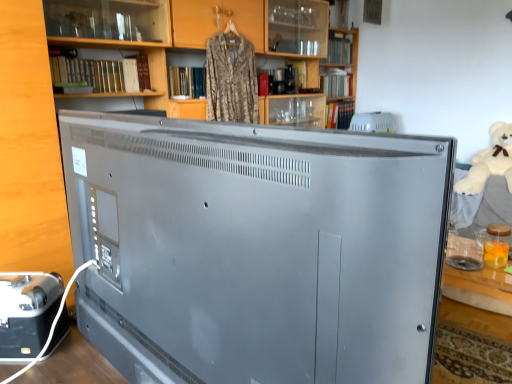
Measure the distance between point (x=318, y=60) and camera.

Point (x=318, y=60) is 3.78 meters from camera.

What do you see at coordinates (27, 312) in the screenshot? This screenshot has width=512, height=384. I see `metallic silver toaster at lower left, the 1th appliance in the bottom-to-top sequence` at bounding box center [27, 312].

Describe the element at coordinates (256, 249) in the screenshot. I see `satin gray television at center` at that location.

In order to face white plastic speaker at upper center, placed as the 2th appliance when sorted from front to back, should I rotate leftwards or rightwards?

A 15.844 degree turn to the right will do.

What do you see at coordinates (373, 122) in the screenshot?
I see `white plastic speaker at upper center, the 1th appliance viewed from the top` at bounding box center [373, 122].

Identify the location of matte wood bookcase at upper center. (218, 32).

Does camouflage fabric shirt at upper center have a lesser height compared to metallic silver toaster at lower left, placed as the second appliance when sorted from right to left?

No, camouflage fabric shirt at upper center is not shorter than metallic silver toaster at lower left, placed as the second appliance when sorted from right to left.

How far apart are camouflage fabric shirt at upper center and metallic silver toaster at lower left, the 1th appliance in the bottom-to-top sequence?

The distance of camouflage fabric shirt at upper center from metallic silver toaster at lower left, the 1th appliance in the bottom-to-top sequence, is 1.78 meters.

Consider the image. Between camouflage fabric shirt at upper center and metallic silver toaster at lower left, the 1th appliance in the bottom-to-top sequence, which one appears on the right side from the viewer's perspective?

camouflage fabric shirt at upper center.

Locate an element on the screen. The height and width of the screenshot is (384, 512). appliance in front of the camouflage fabric shirt at upper center is located at coordinates (27, 312).

Where is `television on the right of metallic silver toaster at lower left, placed as the second appliance when sorted from right to left`? television on the right of metallic silver toaster at lower left, placed as the second appliance when sorted from right to left is located at coordinates pyautogui.click(x=256, y=249).

Is satin gray television at center positioned with its back to metallic silver toaster at lower left, which is the 2th appliance in back-to-front order?

No, satin gray television at center is not facing away from metallic silver toaster at lower left, which is the 2th appliance in back-to-front order.

Looking at the image, does satin gray television at center seem bigger or smaller compared to metallic silver toaster at lower left, placed as the second appliance when sorted from right to left?

satin gray television at center is bigger than metallic silver toaster at lower left, placed as the second appliance when sorted from right to left.

Is white plastic speaker at upper center, the 1th appliance in the right-to-left sequence, oriented towards matte wood bookcase at upper center?

No, white plastic speaker at upper center, the 1th appliance in the right-to-left sequence, is not oriented towards matte wood bookcase at upper center.

Is point (362, 126) less distant than point (251, 10)?

No, (362, 126) is behind (251, 10).

From a real-world perspective, is white plastic speaker at upper center, the 1th appliance viewed from the top, on top of matte wood bookcase at upper center?

Incorrect, from a real-world perspective, white plastic speaker at upper center, the 1th appliance viewed from the top, is lower than matte wood bookcase at upper center.

In the scene shown: How different are the orientations of white plastic speaker at upper center, the 1th appliance in the right-to-left sequence, and matte wood bookcase at upper center in degrees?

They differ by 1.35 degrees in their facing directions.

Looking at the image, does white plush bear at right seem bigger or smaller compared to white plastic speaker at upper center, placed as the 2th appliance when sorted from bottom to top?

In the image, white plush bear at right appears to be larger than white plastic speaker at upper center, placed as the 2th appliance when sorted from bottom to top.

Considering the points (488, 167) and (384, 127), which point is in front, point (488, 167) or point (384, 127)?

The point (488, 167) is closer.

From a real-world perspective, is white plush bear at right over white plastic speaker at upper center, the 1th appliance in the right-to-left sequence?

Incorrect, from a real-world perspective, white plush bear at right is lower than white plastic speaker at upper center, the 1th appliance in the right-to-left sequence.

Considering the relative positions of white plush bear at right and white plastic speaker at upper center, placed as the 2th appliance when sorted from front to back, in the image provided, is white plush bear at right to the right of white plastic speaker at upper center, placed as the 2th appliance when sorted from front to back, from the viewer's perspective?

Correct, you'll find white plush bear at right to the right of white plastic speaker at upper center, placed as the 2th appliance when sorted from front to back.

Who is taller, metallic silver toaster at lower left, placed as the second appliance when sorted from right to left, or white plush bear at right?

Standing taller between the two is white plush bear at right.

Is metallic silver toaster at lower left, which ranks as the 2th appliance in top-to-bottom order, bigger than white plush bear at right?

No, metallic silver toaster at lower left, which ranks as the 2th appliance in top-to-bottom order, is not bigger than white plush bear at right.

This screenshot has height=384, width=512. Identify the location of toy on the right of metallic silver toaster at lower left, placed as the second appliance when sorted from right to left. (490, 161).

Looking at this image, from a real-world perspective, is metallic silver toaster at lower left, the 1th appliance in the bottom-to-top sequence, on white plush bear at right?

No, from a real-world perspective, metallic silver toaster at lower left, the 1th appliance in the bottom-to-top sequence, is not above white plush bear at right.

Is white plush bear at right with metallic silver toaster at lower left, which is the 2th appliance in back-to-front order?

No, white plush bear at right is not touching metallic silver toaster at lower left, which is the 2th appliance in back-to-front order.

Is white plush bear at right aimed at metallic silver toaster at lower left, the 1th appliance in the bottom-to-top sequence?

Yes, white plush bear at right is turned towards metallic silver toaster at lower left, the 1th appliance in the bottom-to-top sequence.

How distant is white plush bear at right from metallic silver toaster at lower left, the 1th appliance in the bottom-to-top sequence?

white plush bear at right and metallic silver toaster at lower left, the 1th appliance in the bottom-to-top sequence, are 3.27 meters apart from each other.

From a real-world perspective, between white plush bear at right and metallic silver toaster at lower left, acting as the 1th appliance starting from the left, who is vertically lower?

metallic silver toaster at lower left, acting as the 1th appliance starting from the left.

Is matte wood bookcase at upper center spatially inside satin gray television at center, or outside of it?

matte wood bookcase at upper center is located beyond the bounds of satin gray television at center.

Is matte wood bookcase at upper center shorter than satin gray television at center?

In fact, matte wood bookcase at upper center may be taller than satin gray television at center.

Is point (245, 18) positioned before point (397, 239)?

No, it is not.

You are a GUI agent. You are given a task and a screenshot of the screen. Output one action in this format:
    pyautogui.click(x=<x>, y=<y>)
    Task: Click on the clothing behind the metallic silver toaster at lower left, placed as the second appliance when sorted from right to left
    
    Given the screenshot: What is the action you would take?
    coord(231,79)

Locate an element on the screen. television located above the metallic silver toaster at lower left, acting as the 1th appliance starting from the left (from a real-world perspective) is located at coordinates (256, 249).

From the image, which object appears to be nearer to white plush bear at right, camouflage fabric shirt at upper center or matte wood bookcase at upper center?

Among the two, camouflage fabric shirt at upper center is located nearer to white plush bear at right.

Considering their positions, is white plush bear at right positioned further to satin gray television at center than matte wood bookcase at upper center?

Among the two, white plush bear at right is located further to satin gray television at center.

Based on their spatial positions, is matte wood bookcase at upper center or satin gray television at center further from white plush bear at right?

satin gray television at center is further to white plush bear at right.

From the image, which object appears to be nearer to metallic silver toaster at lower left, acting as the 1th appliance starting from the left, white plush bear at right or matte wood bookcase at upper center?

Based on the image, matte wood bookcase at upper center appears to be nearer to metallic silver toaster at lower left, acting as the 1th appliance starting from the left.

Which object lies further to the anchor point white plush bear at right, camouflage fabric shirt at upper center or white plastic speaker at upper center, the 1th appliance viewed from the top?

Among the two, camouflage fabric shirt at upper center is located further to white plush bear at right.

Looking at the image, which one is located further to camouflage fabric shirt at upper center, white plush bear at right or satin gray television at center?

white plush bear at right lies further to camouflage fabric shirt at upper center than the other object.

Looking at the image, which one is located closer to white plastic speaker at upper center, placed as the 2th appliance when sorted from front to back, metallic silver toaster at lower left, which ranks as the 2th appliance in top-to-bottom order, or camouflage fabric shirt at upper center?

Among the two, camouflage fabric shirt at upper center is located nearer to white plastic speaker at upper center, placed as the 2th appliance when sorted from front to back.

When comparing their distances from matte wood bookcase at upper center, does camouflage fabric shirt at upper center or white plastic speaker at upper center, placed as the 2th appliance when sorted from bottom to top, seem closer?

The object closer to matte wood bookcase at upper center is camouflage fabric shirt at upper center.

Locate an element on the screen. The height and width of the screenshot is (384, 512). bookcase positioned between satin gray television at center and white plush bear at right from near to far is located at coordinates (218, 32).

The width and height of the screenshot is (512, 384). What are the coordinates of `clothing located between metallic silver toaster at lower left, placed as the second appliance when sorted from right to left, and white plastic speaker at upper center, placed as the 2th appliance when sorted from front to back, in the depth direction` in the screenshot? It's located at (231, 79).

Identify the location of bookcase positioned between satin gray television at center and white plastic speaker at upper center, placed as the 2th appliance when sorted from left to right, from near to far. (218, 32).

Where is `clothing situated between metallic silver toaster at lower left, acting as the 1th appliance starting from the left, and white plush bear at right from left to right`? clothing situated between metallic silver toaster at lower left, acting as the 1th appliance starting from the left, and white plush bear at right from left to right is located at coordinates (231, 79).